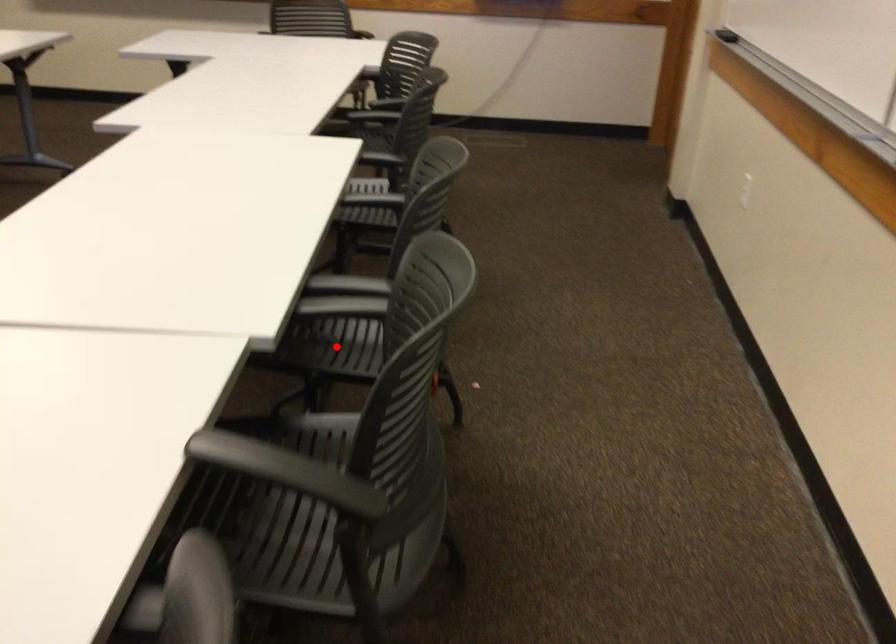
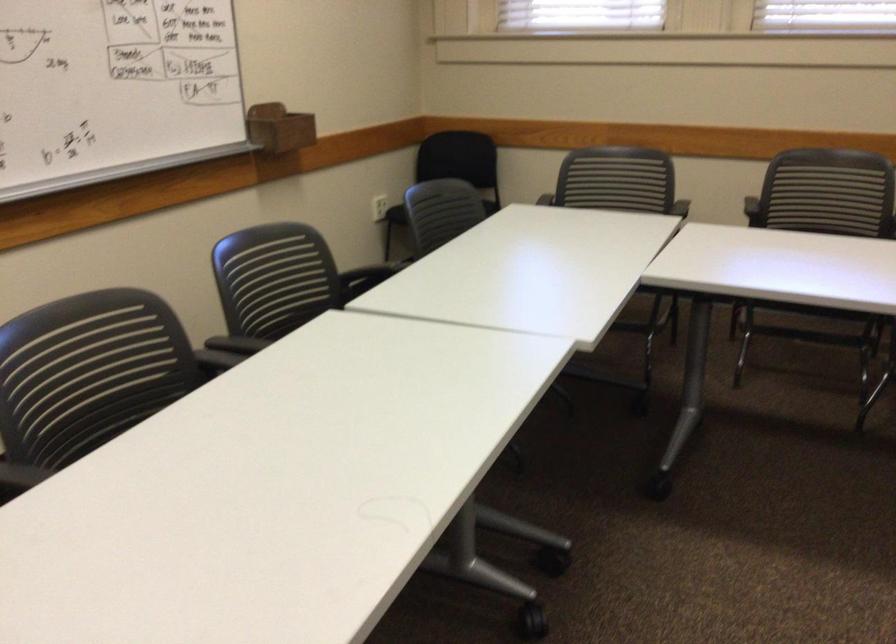
Question: I am providing you with two images of the same scene from different viewpoints. A red point is marked on the first image. At the location where the point appears in image 1, is it still visible in image 2?

Choices:
 (A) Yes
 (B) No

Answer: (B)